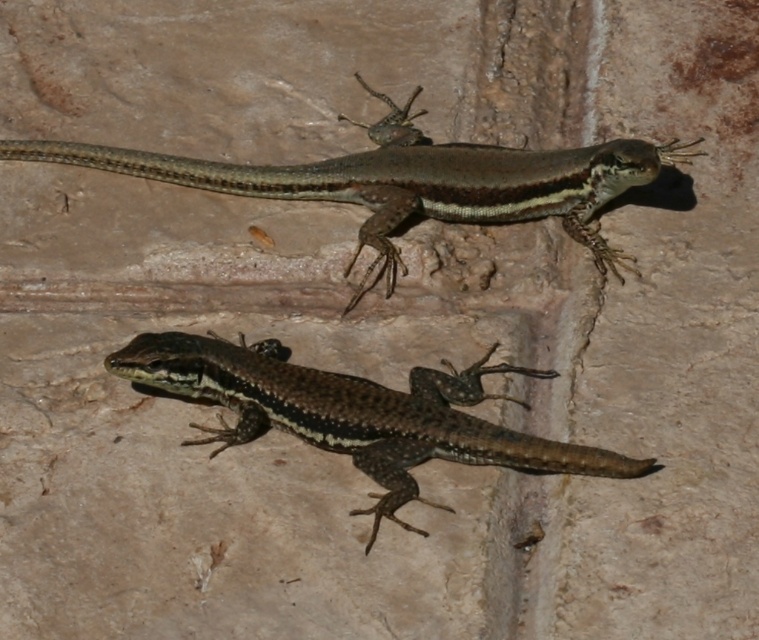
Question: Does brown matte lizard at upper center have a greater width compared to brown scaly lizard at center?

Choices:
 (A) yes
 (B) no

Answer: (A)

Question: Which point is farther to the camera?

Choices:
 (A) (328, 376)
 (B) (587, 170)

Answer: (B)

Question: Does brown matte lizard at upper center appear on the left side of brown scaly lizard at center?

Choices:
 (A) yes
 (B) no

Answer: (A)

Question: Which point appears farthest from the camera in this image?

Choices:
 (A) click(272, 340)
 (B) click(650, 170)

Answer: (B)

Question: Does brown matte lizard at upper center appear on the right side of brown scaly lizard at center?

Choices:
 (A) no
 (B) yes

Answer: (A)